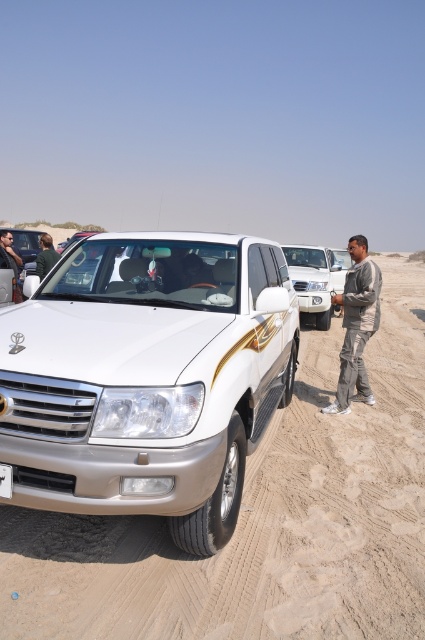
Question: Based on their relative distances, which object is farther from the gray cotton pants at right?

Choices:
 (A) white plastic license plate at center
 (B) white sand dirt track at center

Answer: (A)

Question: Can you confirm if white sand dirt track at center is positioned to the right of white plastic license plate at center?

Choices:
 (A) yes
 (B) no

Answer: (A)

Question: Which point is farther to the camera?

Choices:
 (A) (351, 276)
 (B) (271, 524)
 (C) (328, 285)

Answer: (C)

Question: Is white metallic suv at center bigger than white plastic license plate at center?

Choices:
 (A) yes
 (B) no

Answer: (A)

Question: Is gray cotton pants at right thinner than white plastic license plate at center?

Choices:
 (A) yes
 (B) no

Answer: (B)

Question: Which of these objects is positioned farthest from the white plastic license plate at center?

Choices:
 (A) white metallic suv at center
 (B) gray cotton pants at right

Answer: (A)